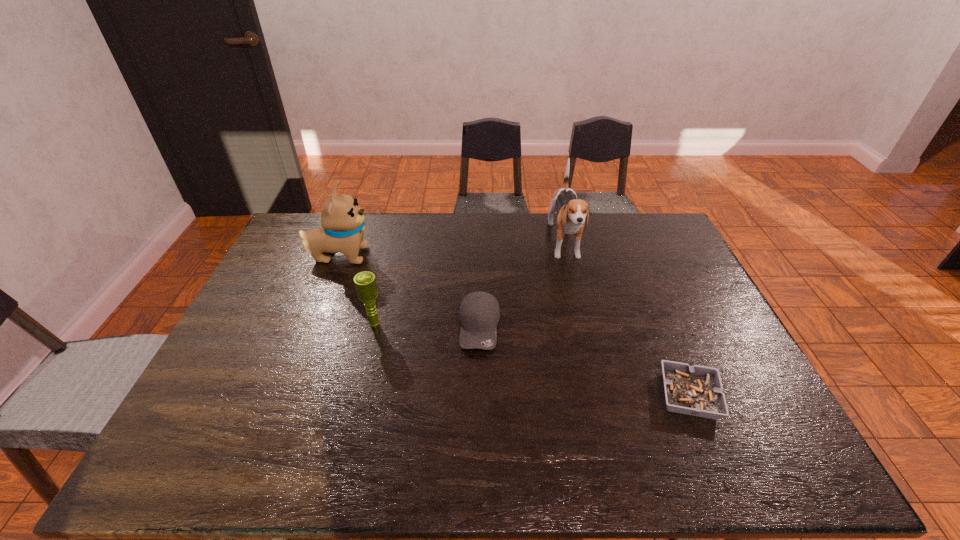
In order to click on the third closest object relative to the third object from right to left in this screenshot , I will do `click(342, 219)`.

Locate an element on the screen. The width and height of the screenshot is (960, 540). vacant space that satisfies the following two spatial constraints: 1. on the face of the leftmost object; 2. on the back side of the fourth object from right to left is located at coordinates (313, 324).

This screenshot has width=960, height=540. What are the coordinates of `blank area in the image that satisfies the following two spatial constraints: 1. at the face of the fourth object from left to right; 2. on the face of the leftmost object` in the screenshot? It's located at (567, 255).

The width and height of the screenshot is (960, 540). What are the coordinates of `vacant area in the image that satisfies the following two spatial constraints: 1. at the face of the second object from right to left; 2. on the face of the leftmost object` in the screenshot? It's located at (567, 255).

Where is `free space that satisfies the following two spatial constraints: 1. on the back side of the rightmost object; 2. on the face of the leftmost object`? free space that satisfies the following two spatial constraints: 1. on the back side of the rightmost object; 2. on the face of the leftmost object is located at coordinates (631, 255).

Image resolution: width=960 pixels, height=540 pixels. What are the coordinates of `vacant area that satisfies the following two spatial constraints: 1. on the face of the leftmost object; 2. on the left side of the microphone` in the screenshot? It's located at (313, 324).

Identify the location of free space in the image that satisfies the following two spatial constraints: 1. at the face of the ashtray; 2. on the right side of the right puppy. The width and height of the screenshot is (960, 540). (601, 396).

Image resolution: width=960 pixels, height=540 pixels. I want to click on vacant space that satisfies the following two spatial constraints: 1. on the face of the microphone; 2. on the left side of the leftmost object, so click(313, 324).